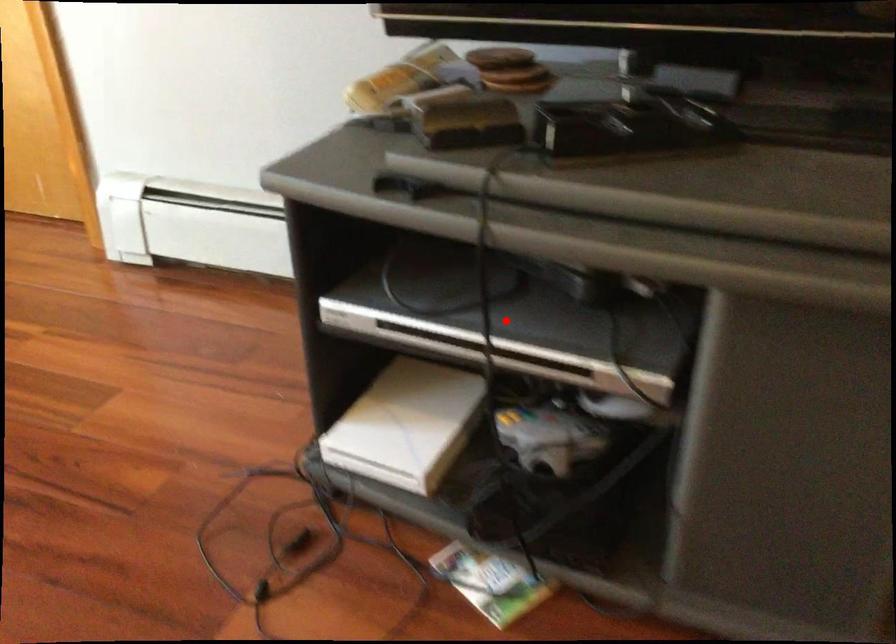
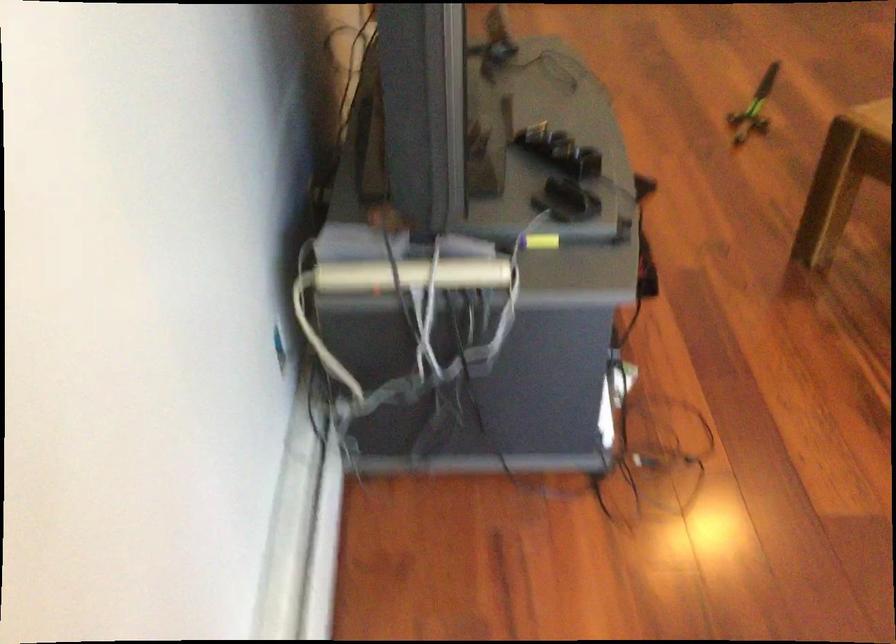
Question: I am providing you with two images of the same scene from different viewpoints. A red point is marked on the first image. At the location where the point appears in image 1, is it still visible in image 2?

Choices:
 (A) Yes
 (B) No

Answer: (B)